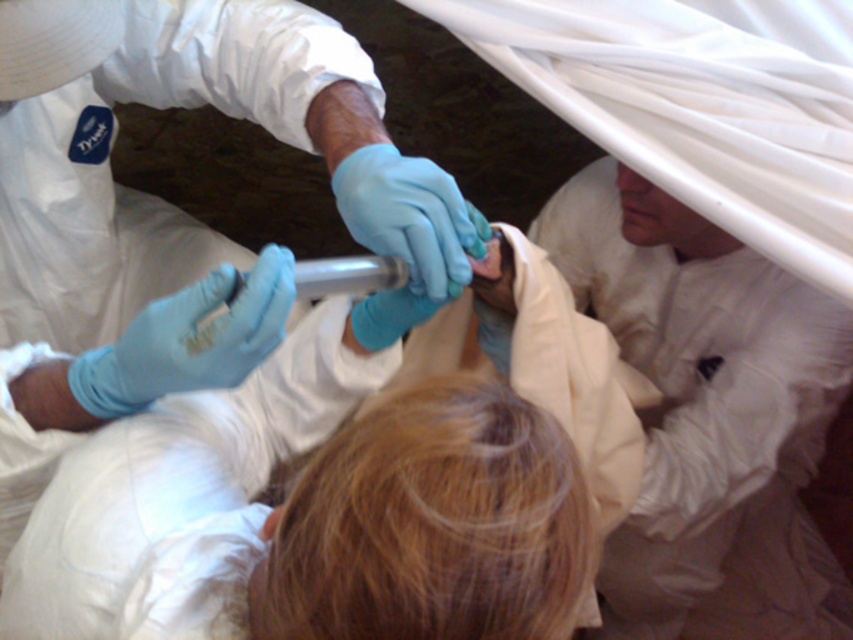
You are a medical assistant in the scene. You need to place a small medical kit on the white matte fabric at upper right. The coordinates given are in a normalized system where the bottom left corner is the origin. Is the point marked at (708, 417) suitable for placing the kit without overlapping other objects?

The point marked at (708, 417) corresponds to the white matte fabric at upper right, so placing the kit there would be suitable as it is on the designated fabric and there are no other objects mentioned in that area.

Based on the photo, you are a researcher in a lab and you need to reach the point at coordinates point (711, 305). The lab has a safety protocol that requires you to stay within 4 feet of your current position. Can you safely reach the point?

The point (711, 305) is 4.44 feet away from camera, which exceeds the 4 feet safety protocol limit. You cannot safely reach it without violating the protocol.